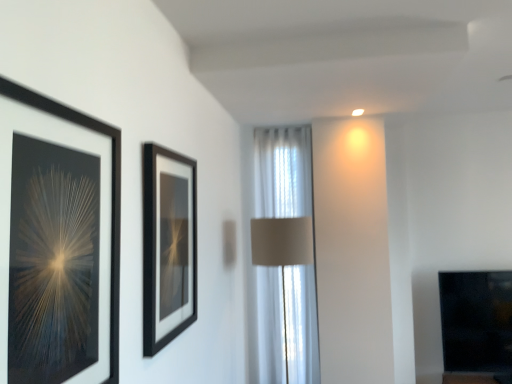
Question: Considering the relative positions of white sheer curtain at center and black matte picture frame at left, the second picture frame from the right, in the image provided, is white sheer curtain at center behind black matte picture frame at left, the second picture frame from the right,?

Choices:
 (A) yes
 (B) no

Answer: (A)

Question: Are white sheer curtain at center and black matte picture frame at left, the second picture frame from the right, beside each other?

Choices:
 (A) yes
 (B) no

Answer: (B)

Question: Is white sheer curtain at center bigger than black matte picture frame at left, the second picture frame from the right?

Choices:
 (A) yes
 (B) no

Answer: (A)

Question: Does white sheer curtain at center contain black matte picture frame at left, marked as the second picture frame in a back-to-front arrangement?

Choices:
 (A) no
 (B) yes

Answer: (A)

Question: Can you confirm if white sheer curtain at center is taller than black matte picture frame at left, the 1th picture frame positioned from the left?

Choices:
 (A) no
 (B) yes

Answer: (B)

Question: From a real-world perspective, is white sheer curtain at center physically above black matte picture frame at left, marked as the second picture frame in a back-to-front arrangement?

Choices:
 (A) yes
 (B) no

Answer: (B)

Question: Can you confirm if black matte picture frame at center, which is the 1th picture frame from right to left, is thinner than white sheer curtain at center?

Choices:
 (A) yes
 (B) no

Answer: (A)

Question: From the image's perspective, is black matte picture frame at center, which is the 2th picture frame from left to right, above white sheer curtain at center?

Choices:
 (A) no
 (B) yes

Answer: (B)

Question: Can you confirm if black matte picture frame at center, which is the 1th picture frame from right to left, is taller than white sheer curtain at center?

Choices:
 (A) yes
 (B) no

Answer: (B)

Question: Is black matte picture frame at center, placed as the first picture frame when sorted from back to front, looking in the opposite direction of white sheer curtain at center?

Choices:
 (A) no
 (B) yes

Answer: (A)

Question: Is black matte picture frame at center, which is the 2th picture frame from left to right, facing towards white sheer curtain at center?

Choices:
 (A) no
 (B) yes

Answer: (A)

Question: Does black matte picture frame at center, which is the 2th picture frame from left to right, appear on the left side of white sheer curtain at center?

Choices:
 (A) yes
 (B) no

Answer: (A)

Question: Does black matte picture frame at left, the 1th picture frame positioned from the left, lie in front of white sheer curtain at center?

Choices:
 (A) no
 (B) yes

Answer: (B)